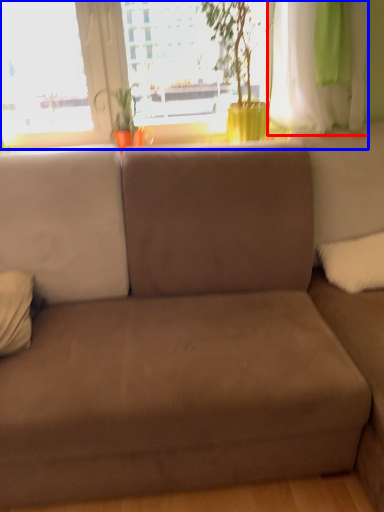
Question: Which point is closer to the camera, curtain (highlighted by a red box) or window (highlighted by a blue box)?

Choices:
 (A) curtain
 (B) window

Answer: (A)